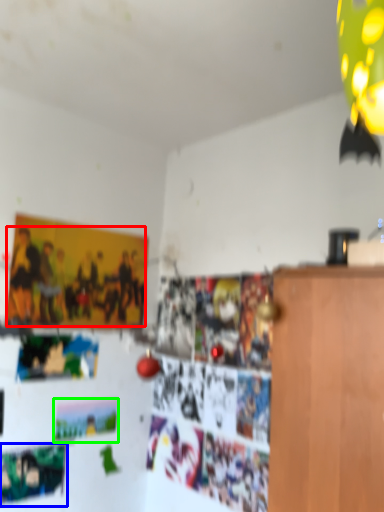
Question: Which object is the farthest from person (highlighted by a red box)? Choose among these: poster (highlighted by a blue box) or postcard (highlighted by a green box).

Choices:
 (A) poster
 (B) postcard

Answer: (A)